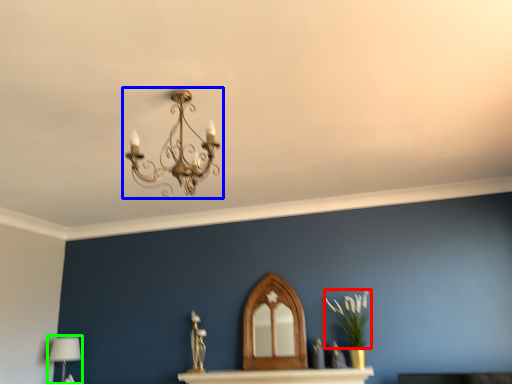
Question: Estimate the real-world distances between objects in this image. Which object is closer to plant (highlighted by a red box), lamp (highlighted by a blue box) or table lamp (highlighted by a green box)?

Choices:
 (A) lamp
 (B) table lamp

Answer: (A)